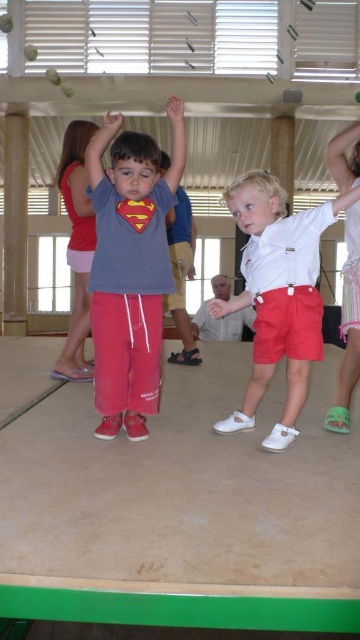
Question: Which object is closer to the camera taking this photo?

Choices:
 (A) white smooth shorts at center
 (B) matte gray shirt at center

Answer: (A)

Question: Is matte gray shirt at center above white smooth shorts at center?

Choices:
 (A) no
 (B) yes

Answer: (B)

Question: Which point is farther to the camera?

Choices:
 (A) white smooth shorts at center
 (B) matte gray shirt at center

Answer: (B)

Question: Can you confirm if matte gray shirt at center is positioned to the right of white smooth shorts at center?

Choices:
 (A) no
 (B) yes

Answer: (A)

Question: Where is matte gray shirt at center located in relation to white smooth shorts at center in the image?

Choices:
 (A) below
 (B) above

Answer: (B)

Question: Among these points, which one is nearest to the camera?

Choices:
 (A) (95, 340)
 (B) (262, 264)

Answer: (B)